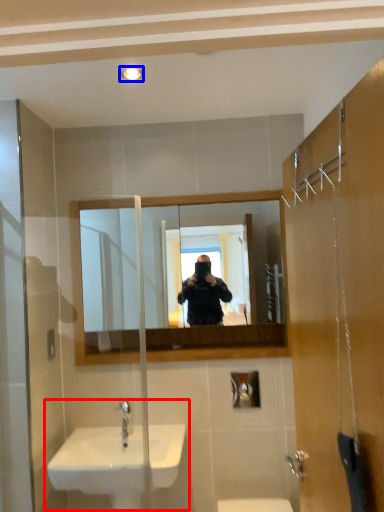
Question: Which object is further to the camera taking this photo, sink (highlighted by a red box) or light fixture (highlighted by a blue box)?

Choices:
 (A) sink
 (B) light fixture

Answer: (A)